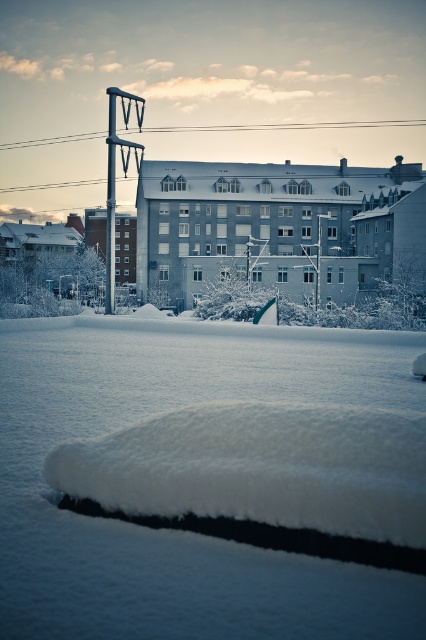
Question: Among these objects, which one is nearest to the camera?

Choices:
 (A) snow-covered building at left
 (B) brick building at center

Answer: (B)

Question: Which of the following is the closest to the observer?

Choices:
 (A) (344, 195)
 (B) (48, 244)
 (C) (134, 236)
 (D) (80, 349)

Answer: (D)

Question: Is snow-covered building at left positioned before brick building at center?

Choices:
 (A) yes
 (B) no

Answer: (B)

Question: Can you confirm if white fluffy snow at center is positioned to the right of gray concrete building at center?

Choices:
 (A) no
 (B) yes

Answer: (A)

Question: Considering the relative positions of snow-covered building at left and brick building at center in the image provided, where is snow-covered building at left located with respect to brick building at center?

Choices:
 (A) above
 (B) below

Answer: (A)

Question: Which of these objects is positioned closest to the gray concrete building at center?

Choices:
 (A) snow-covered building at left
 (B) brick building at center
 (C) white fluffy snow at center

Answer: (B)